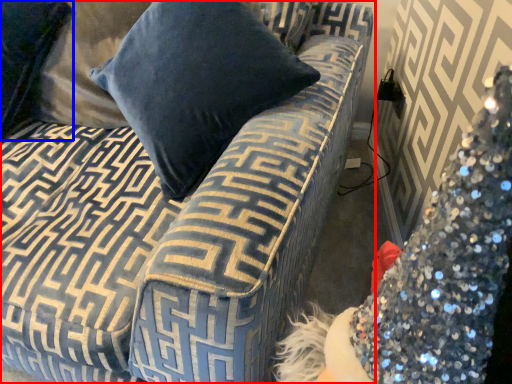
Question: Which point is further to the camera, studio couch (highlighted by a red box) or pillow (highlighted by a blue box)?

Choices:
 (A) studio couch
 (B) pillow

Answer: (B)